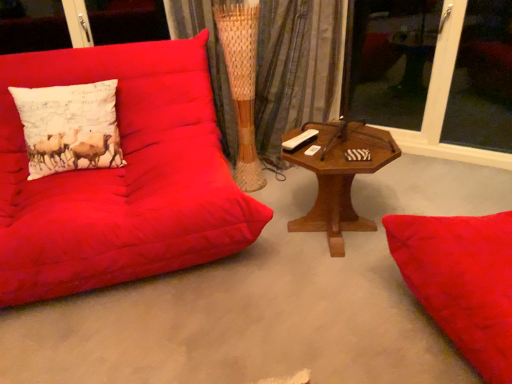
Where is `free space that is in between matte red couch at left and woodenobject at center`? free space that is in between matte red couch at left and woodenobject at center is located at coordinates (276, 225).